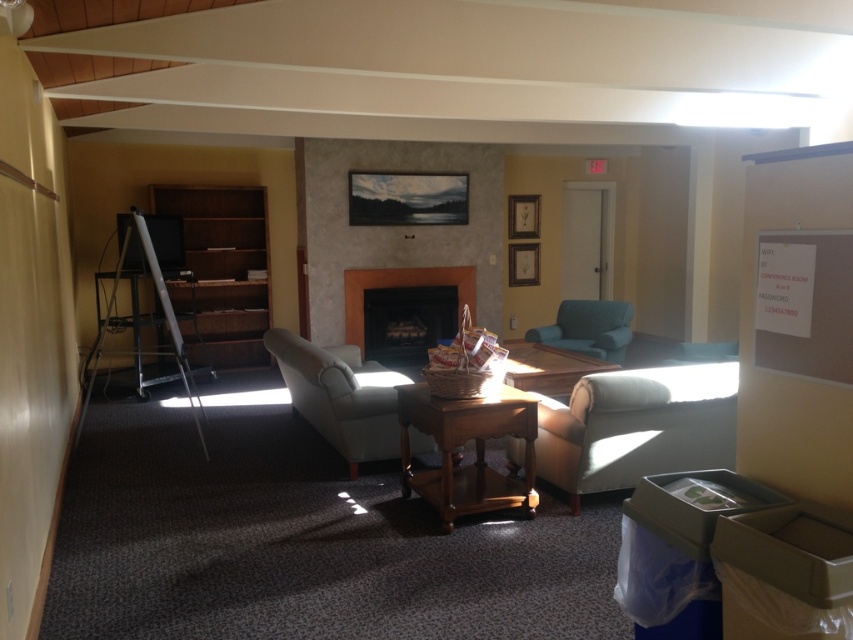
Between wooden bookshelf at left and light blue fabric armchair at center, which one has less height?

light blue fabric armchair at center is shorter.

Does wooden bookshelf at left have a lesser height compared to light blue fabric armchair at center?

No, wooden bookshelf at left is not shorter than light blue fabric armchair at center.

Which is in front, point (250, 241) or point (366, 424)?

Point (366, 424) is in front.

In order to click on wooden bookshelf at left in this screenshot , I will do `click(221, 272)`.

Does wooden bookshelf at left appear under wooden table at center?

Incorrect, wooden bookshelf at left is not positioned below wooden table at center.

Looking at this image, is wooden bookshelf at left wider than wooden table at center?

Yes.

Where is `wooden bookshelf at left`? This screenshot has height=640, width=853. wooden bookshelf at left is located at coordinates (221, 272).

Is light blue fabric armchair at center below matte stone fireplace at center?

Indeed, light blue fabric armchair at center is positioned under matte stone fireplace at center.

This screenshot has width=853, height=640. I want to click on light blue fabric armchair at center, so click(x=337, y=396).

Identify the location of light blue fabric armchair at center. The width and height of the screenshot is (853, 640). (337, 396).